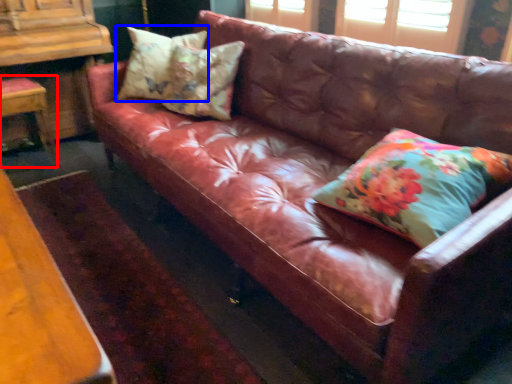
Question: Among these objects, which one is farthest to the camera, chair (highlighted by a red box) or pillow (highlighted by a blue box)?

Choices:
 (A) chair
 (B) pillow

Answer: (A)